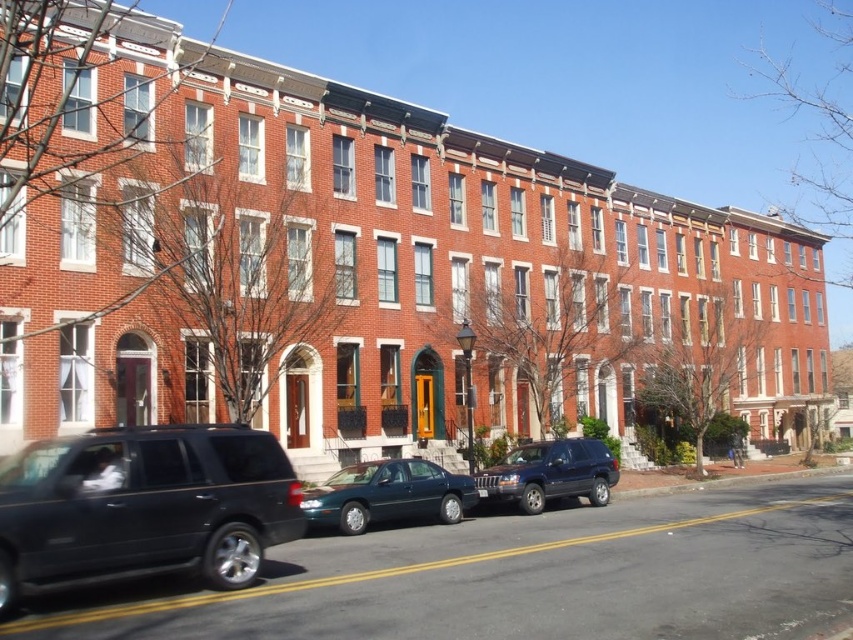
In the scene shown: Who is taller, shiny black suv at lower left or shiny dark blue suv at center?

With more height is shiny black suv at lower left.

Is point (222, 577) more distant than point (584, 465)?

No, it is in front of (584, 465).

At what (x,y) coordinates should I click in order to perform the action: click on shiny black suv at lower left. Please return your answer as a coordinate pair (x, y). Image resolution: width=853 pixels, height=640 pixels. Looking at the image, I should click on (144, 506).

Who is shorter, shiny black suv at lower left or teal glossy sedan at center?

teal glossy sedan at center is shorter.

Does point (136, 541) come in front of point (334, 513)?

Yes, point (136, 541) is closer to viewer.

Who is more distant from viewer, (253,573) or (390,499)?

Point (390,499)

In order to click on shiny black suv at lower left in this screenshot , I will do `click(144, 506)`.

Is point (323, 525) closer to viewer compared to point (556, 497)?

Yes, it is in front of point (556, 497).

Is teal glossy sedan at center to the right of shiny dark blue suv at center from the viewer's perspective?

Incorrect, teal glossy sedan at center is not on the right side of shiny dark blue suv at center.

Describe the element at coordinates (387, 493) in the screenshot. This screenshot has width=853, height=640. I see `teal glossy sedan at center` at that location.

The image size is (853, 640). Identify the location of teal glossy sedan at center. (387, 493).